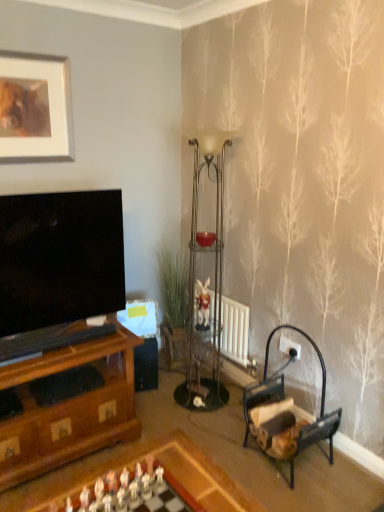
Question: From their relative heights in the image, would you say matte silver picture frame at upper left is taller or shorter than matte glass candle holder at center?

Choices:
 (A) short
 (B) tall

Answer: (B)

Question: Considering the positions of point (6, 56) and point (203, 237), is point (6, 56) closer or farther from the camera than point (203, 237)?

Choices:
 (A) farther
 (B) closer

Answer: (B)

Question: Which object is positioned closest to the metallic glass side table at center?

Choices:
 (A) matte silver picture frame at upper left
 (B) wooden chess set at center
 (C) matte glass candle holder at center
 (D) metallic glass shelf at center
 (E) wooden armchair at lower right

Answer: (D)

Question: Which is nearer to the matte glass candle holder at center?

Choices:
 (A) wooden chess set at center
 (B) matte silver picture frame at upper left
 (C) wooden chessboard at lower center
 (D) metallic glass shelf at center
 (E) metallic glass side table at center

Answer: (D)